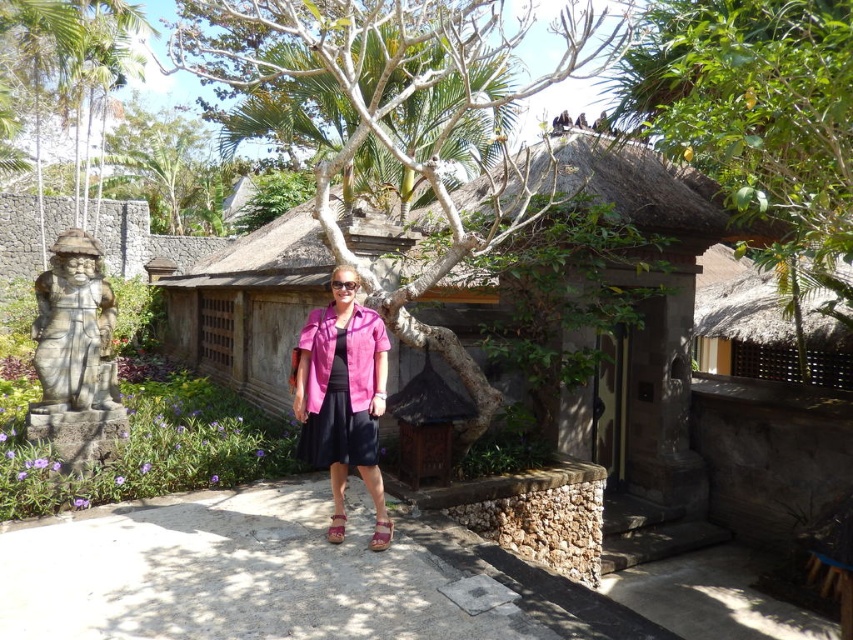
Based on the photo, is brown thatch hut at center taller than green leafy tree at upper left?

Correct, brown thatch hut at center is much taller as green leafy tree at upper left.

Can you confirm if brown thatch hut at center is smaller than green leafy tree at upper left?

Actually, brown thatch hut at center might be larger than green leafy tree at upper left.

From the picture: Measure the distance between brown thatch hut at center and camera.

brown thatch hut at center is 5.77 meters away from camera.

Locate an element on the screen. This screenshot has height=640, width=853. brown thatch hut at center is located at coordinates (700, 374).

Between green leafy tree at upper right and green leafy tree at upper left, which one appears on the right side from the viewer's perspective?

green leafy tree at upper right is more to the right.

Which is behind, point (775, 209) or point (195, 211)?

Positioned behind is point (195, 211).

Describe the element at coordinates (757, 120) in the screenshot. I see `green leafy tree at upper right` at that location.

At what (x,y) coordinates should I click in order to perform the action: click on green leafy tree at upper right. Please return your answer as a coordinate pair (x, y). Image resolution: width=853 pixels, height=640 pixels. Looking at the image, I should click on (757, 120).

Who is shorter, bare wood tree at center or stone statue at left?

stone statue at left

Who is more distant from viewer, (258, 1) or (74, 353)?

The point (258, 1) is more distant.

Is point (180, 68) behind point (78, 237)?

Yes, it is.

At what (x,y) coordinates should I click in order to perform the action: click on bare wood tree at center. Please return your answer as a coordinate pair (x, y). The width and height of the screenshot is (853, 640). Looking at the image, I should click on (398, 108).